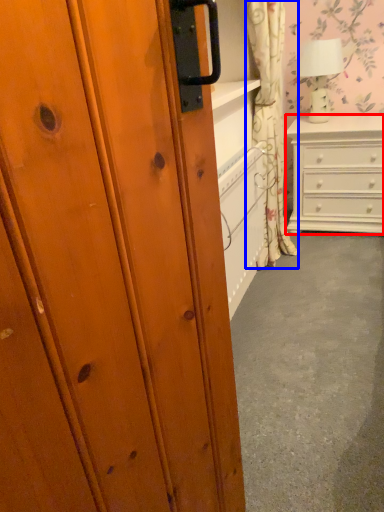
Question: Which point is closer to the camera, chest of drawers (highlighted by a red box) or curtain (highlighted by a blue box)?

Choices:
 (A) chest of drawers
 (B) curtain

Answer: (B)